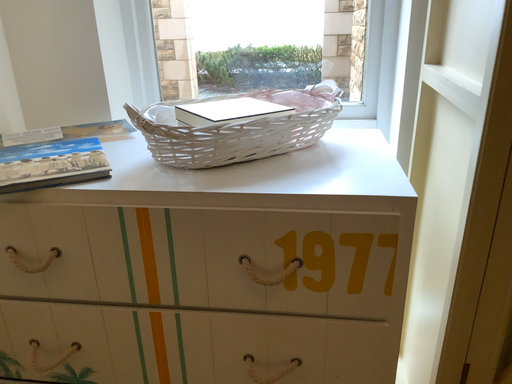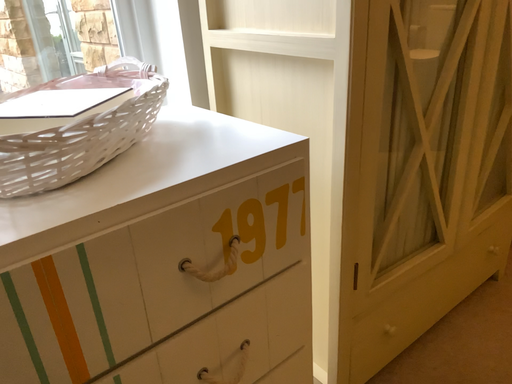
Question: Which way did the camera rotate in the video?

Choices:
 (A) rotated downward
 (B) rotated upward

Answer: (B)